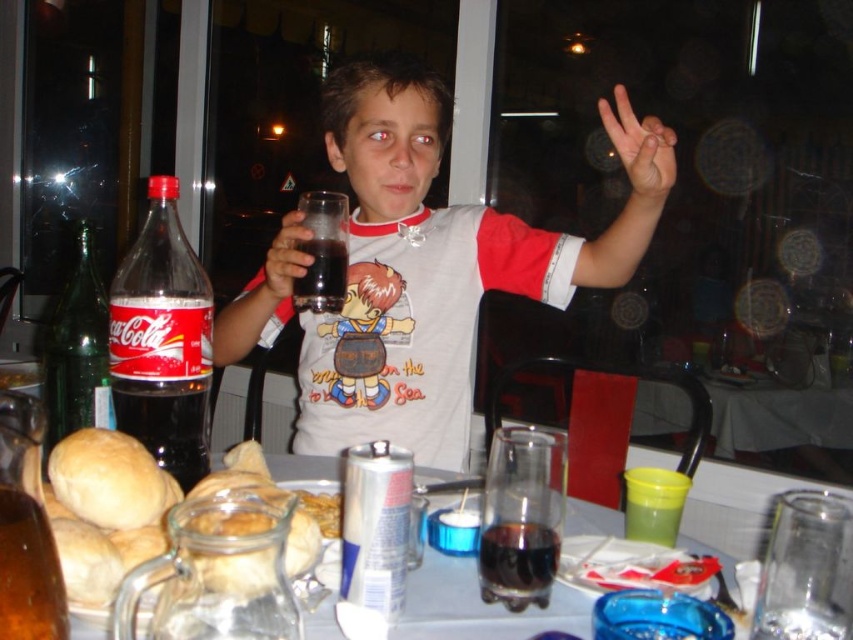
What is the color of the object located at coordinates point [425,269]?

The object at point [425,269] is matte black.

You are a guest at the table and want to reach for the golden bread rolls at lower left without disturbing the translucent plastic bottle at left. Which direction should you move your hand to grab them?

The translucent plastic bottle at left is positioned on the left side of golden bread rolls at lower left. To avoid disturbing it, you should move your hand to the right side of the translucent plastic bottle at left to reach the golden bread rolls at lower left.